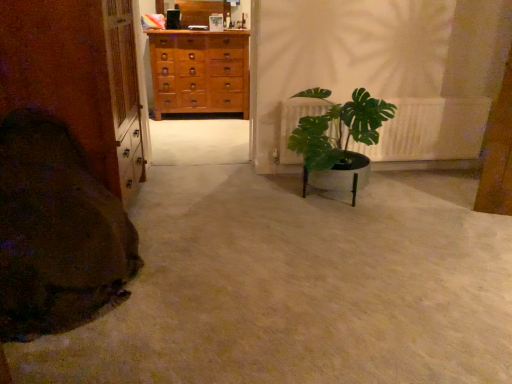
Question: Considering the positions of point (47, 185) and point (187, 71), is point (47, 185) closer or farther from the camera than point (187, 71)?

Choices:
 (A) closer
 (B) farther

Answer: (A)

Question: From the image's perspective, is brown soft blanket at lower left located above or below light brown wooden chest of drawers at center?

Choices:
 (A) below
 (B) above

Answer: (A)

Question: Estimate the real-world distances between objects in this image. Which object is closer to the green leafy plant at center?

Choices:
 (A) light brown wooden chest of drawers at center
 (B) green leafy plant at right
 (C) brown soft blanket at lower left

Answer: (B)

Question: Based on their relative distances, which object is nearer to the green leafy plant at center?

Choices:
 (A) light brown wooden chest of drawers at center
 (B) green leafy plant at right
 (C) brown soft blanket at lower left

Answer: (B)